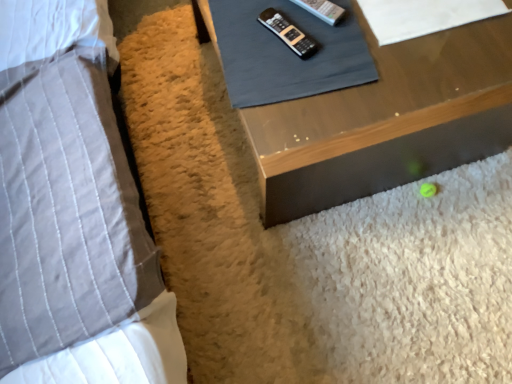
Locate an element on the screen. The image size is (512, 384). vacant area in front of white paper at upper right, which is counted as the 1th sheet, starting from the right is located at coordinates (405, 76).